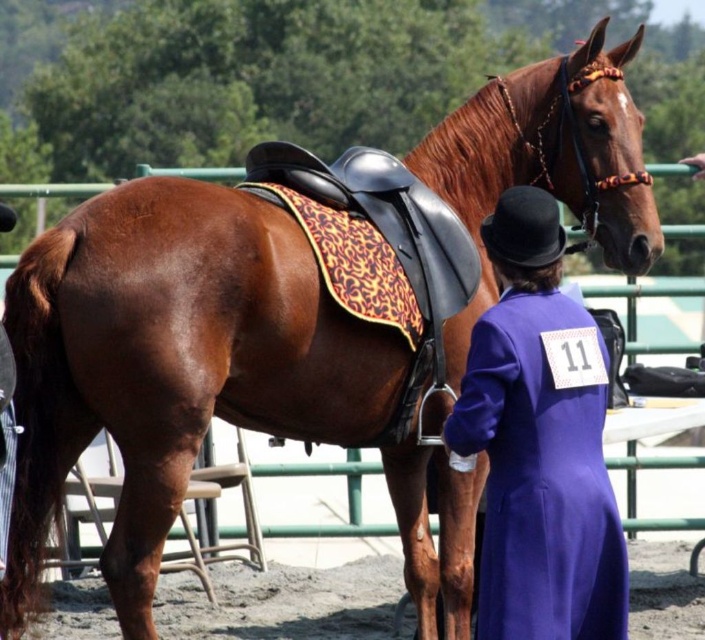
Question: Which point is closer to the camera?

Choices:
 (A) (544, 426)
 (B) (680, 570)

Answer: (A)

Question: Which of the following is the farthest from the observer?

Choices:
 (A) dirt field at lower center
 (B) purple wool coat at center

Answer: (A)

Question: From the image, what is the correct spatial relationship of purple wool coat at center in relation to dirt field at lower center?

Choices:
 (A) below
 (B) above

Answer: (B)

Question: Among these objects, which one is nearest to the camera?

Choices:
 (A) purple wool coat at center
 (B) dirt field at lower center

Answer: (A)

Question: Can you confirm if purple wool coat at center is wider than dirt field at lower center?

Choices:
 (A) yes
 (B) no

Answer: (B)

Question: Is purple wool coat at center further to camera compared to dirt field at lower center?

Choices:
 (A) yes
 (B) no

Answer: (B)